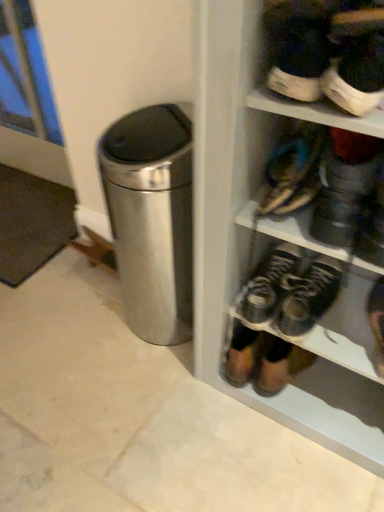
This screenshot has height=512, width=384. Describe the element at coordinates (294, 170) in the screenshot. I see `leather sandals at upper right, which ranks as the third footwear in bottom-to-top order` at that location.

The width and height of the screenshot is (384, 512). Identify the location of dark brown leather shoes at center, the 2th footwear from the bottom. (268, 285).

In the scene shown: Does white rubber sneaker at upper right, which ranks as the 4th footwear in bottom-to-top order, come in front of dark brown leather shoes at center, the 2th footwear from the bottom?

That is True.

Consider the image. From the image's perspective, who appears lower, white rubber sneaker at upper right, which ranks as the 4th footwear in bottom-to-top order, or dark brown leather shoes at center, which is the third footwear from top to bottom?

dark brown leather shoes at center, which is the third footwear from top to bottom.

What's the angular difference between white rubber sneaker at upper right, which ranks as the 4th footwear in bottom-to-top order, and dark brown leather shoes at center, which is the third footwear from top to bottom,'s facing directions?

The angular difference between white rubber sneaker at upper right, which ranks as the 4th footwear in bottom-to-top order, and dark brown leather shoes at center, which is the third footwear from top to bottom, is 1.18 degrees.

Which of these two, white rubber sneaker at upper right, which ranks as the 4th footwear in bottom-to-top order, or dark brown leather shoes at center, the 2th footwear from the bottom, is bigger?

Bigger between the two is dark brown leather shoes at center, the 2th footwear from the bottom.

There is a dark brown leather shoes at center, the 2th footwear from the bottom. At what (x,y) coordinates should I click in order to perform the action: click on the 2nd footwear above it (from a real-world perspective). Please return your answer as a coordinate pair (x, y). This screenshot has height=512, width=384. Looking at the image, I should click on pyautogui.click(x=294, y=170).

How different are the orientations of dark brown leather shoes at center, the 2th footwear from the bottom, and leather sandals at upper right, which ranks as the third footwear in bottom-to-top order, in degrees?

The angle between the facing direction of dark brown leather shoes at center, the 2th footwear from the bottom, and the facing direction of leather sandals at upper right, which ranks as the third footwear in bottom-to-top order, is 3.46 degrees.

Which is in front, point (271, 302) or point (294, 166)?

The point (294, 166) is closer to the camera.

From the picture: Considering the sizes of objects dark brown leather shoes at center, which is the third footwear from top to bottom, and leather sandals at upper right, which ranks as the third footwear in bottom-to-top order, in the image provided, who is wider, dark brown leather shoes at center, which is the third footwear from top to bottom, or leather sandals at upper right, which ranks as the third footwear in bottom-to-top order,?

Wider between the two is leather sandals at upper right, which ranks as the third footwear in bottom-to-top order.

From the picture: Is leather shoe at lower right, the first footwear ordered from the bottom, positioned with its back to dark brown leather shoes at center, which is the third footwear from top to bottom?

leather shoe at lower right, the first footwear ordered from the bottom, is not turned away from dark brown leather shoes at center, which is the third footwear from top to bottom.

Who is shorter, leather shoe at lower right, the first footwear ordered from the bottom, or dark brown leather shoes at center, which is the third footwear from top to bottom?

With less height is leather shoe at lower right, the first footwear ordered from the bottom.

Between leather shoe at lower right, the first footwear ordered from the bottom, and dark brown leather shoes at center, the 2th footwear from the bottom, which one has smaller width?

With smaller width is dark brown leather shoes at center, the 2th footwear from the bottom.

Identify the location of the 2nd footwear to the right of the white rubber sneaker at upper right, arranged as the 1th footwear when viewed from the top, counting from the anchor's position. The height and width of the screenshot is (512, 384). 377,322.

Is point (309, 48) in front of point (374, 292)?

Yes.

Based on the photo, are white rubber sneaker at upper right, arranged as the 1th footwear when viewed from the top, and leather shoe at lower right, the first footwear ordered from the bottom, far apart?

Actually, white rubber sneaker at upper right, arranged as the 1th footwear when viewed from the top, and leather shoe at lower right, the first footwear ordered from the bottom, are a little close together.

Based on the photo, is white rubber sneaker at upper right, arranged as the 1th footwear when viewed from the top, bigger or smaller than leather shoe at lower right, the first footwear ordered from the bottom?

Clearly, white rubber sneaker at upper right, arranged as the 1th footwear when viewed from the top, is smaller in size than leather shoe at lower right, the first footwear ordered from the bottom.

From a real-world perspective, is leather shoe at lower right, the first footwear ordered from the bottom, physically above leather sandals at upper right, which ranks as the third footwear in bottom-to-top order?

No, from a real-world perspective, leather shoe at lower right, the first footwear ordered from the bottom, is not on top of leather sandals at upper right, which ranks as the third footwear in bottom-to-top order.

From the image's perspective, is leather shoe at lower right, the first footwear ordered from the bottom, positioned above or below leather sandals at upper right, which appears as the second footwear when viewed from the top?

From the image's perspective, leather shoe at lower right, the first footwear ordered from the bottom, appears below leather sandals at upper right, which appears as the second footwear when viewed from the top.

Is leather shoe at lower right, the first footwear ordered from the bottom, at the left side of leather sandals at upper right, which appears as the second footwear when viewed from the top?

Incorrect, leather shoe at lower right, the first footwear ordered from the bottom, is not on the left side of leather sandals at upper right, which appears as the second footwear when viewed from the top.

Considering the positions of objects leather shoe at lower right, the fourth footwear positioned from the top, and leather sandals at upper right, which ranks as the third footwear in bottom-to-top order, in the image provided, who is in front, leather shoe at lower right, the fourth footwear positioned from the top, or leather sandals at upper right, which ranks as the third footwear in bottom-to-top order,?

leather sandals at upper right, which ranks as the third footwear in bottom-to-top order, is in front.

Is leather shoe at lower right, the first footwear ordered from the bottom, with white rubber sneaker at upper right, arranged as the 1th footwear when viewed from the top?

No.

Could you measure the distance between leather shoe at lower right, the fourth footwear positioned from the top, and white rubber sneaker at upper right, which ranks as the 4th footwear in bottom-to-top order?

leather shoe at lower right, the fourth footwear positioned from the top, and white rubber sneaker at upper right, which ranks as the 4th footwear in bottom-to-top order, are 59.26 centimeters apart from each other.

Is white rubber sneaker at upper right, arranged as the 1th footwear when viewed from the top, at the back of leather shoe at lower right, the fourth footwear positioned from the top?

No.

Is leather shoe at lower right, the first footwear ordered from the bottom, inside or outside of white rubber sneaker at upper right, which ranks as the 4th footwear in bottom-to-top order?

leather shoe at lower right, the first footwear ordered from the bottom, is not enclosed by white rubber sneaker at upper right, which ranks as the 4th footwear in bottom-to-top order.

Is white rubber sneaker at upper right, which ranks as the 4th footwear in bottom-to-top order, facing away from leather sandals at upper right, which ranks as the third footwear in bottom-to-top order?

No, leather sandals at upper right, which ranks as the third footwear in bottom-to-top order, is not at the back of white rubber sneaker at upper right, which ranks as the 4th footwear in bottom-to-top order.

Between white rubber sneaker at upper right, which ranks as the 4th footwear in bottom-to-top order, and leather sandals at upper right, which appears as the second footwear when viewed from the top, which one has smaller size?

white rubber sneaker at upper right, which ranks as the 4th footwear in bottom-to-top order, is smaller.

From a real-world perspective, is white rubber sneaker at upper right, which ranks as the 4th footwear in bottom-to-top order, physically above leather sandals at upper right, which ranks as the third footwear in bottom-to-top order?

Indeed, from a real-world perspective, white rubber sneaker at upper right, which ranks as the 4th footwear in bottom-to-top order, stands above leather sandals at upper right, which ranks as the third footwear in bottom-to-top order.

How many degrees apart are the facing directions of white rubber sneaker at upper right, arranged as the 1th footwear when viewed from the top, and leather sandals at upper right, which ranks as the third footwear in bottom-to-top order?

white rubber sneaker at upper right, arranged as the 1th footwear when viewed from the top, and leather sandals at upper right, which ranks as the third footwear in bottom-to-top order, are facing 4.65 degrees away from each other.

From the image's perspective, count 2nd footwears upward from the dark brown leather shoes at center, the 2th footwear from the bottom, and point to it. Please provide its 2D coordinates.

[(323, 55)]

Where is `the 2nd footwear to the left when counting from the leather sandals at upper right, which appears as the second footwear when viewed from the top`? The width and height of the screenshot is (384, 512). the 2nd footwear to the left when counting from the leather sandals at upper right, which appears as the second footwear when viewed from the top is located at coordinates (268, 285).

Considering their positions, is leather shoe at lower right, the first footwear ordered from the bottom, positioned further to white rubber sneaker at upper right, arranged as the 1th footwear when viewed from the top, than dark brown leather shoes at center, which is the third footwear from top to bottom?

Among the two, leather shoe at lower right, the first footwear ordered from the bottom, is located further to white rubber sneaker at upper right, arranged as the 1th footwear when viewed from the top.

Estimate the real-world distances between objects in this image. Which object is closer to leather sandals at upper right, which ranks as the third footwear in bottom-to-top order, dark brown leather shoes at center, the 2th footwear from the bottom, or white rubber sneaker at upper right, which ranks as the 4th footwear in bottom-to-top order?

The object closer to leather sandals at upper right, which ranks as the third footwear in bottom-to-top order, is white rubber sneaker at upper right, which ranks as the 4th footwear in bottom-to-top order.

When comparing their distances from dark brown leather shoes at center, which is the third footwear from top to bottom, does leather shoe at lower right, the first footwear ordered from the bottom, or white rubber sneaker at upper right, which ranks as the 4th footwear in bottom-to-top order, seem closer?

leather shoe at lower right, the first footwear ordered from the bottom, lies closer to dark brown leather shoes at center, which is the third footwear from top to bottom, than the other object.

Based on their spatial positions, is leather sandals at upper right, which ranks as the third footwear in bottom-to-top order, or leather shoe at lower right, the first footwear ordered from the bottom, further from white rubber sneaker at upper right, which ranks as the 4th footwear in bottom-to-top order?

leather shoe at lower right, the first footwear ordered from the bottom.

Looking at the image, which one is located closer to leather shoe at lower right, the fourth footwear positioned from the top, leather sandals at upper right, which ranks as the third footwear in bottom-to-top order, or white rubber sneaker at upper right, which ranks as the 4th footwear in bottom-to-top order?

Among the two, leather sandals at upper right, which ranks as the third footwear in bottom-to-top order, is located nearer to leather shoe at lower right, the fourth footwear positioned from the top.

From the image, which object appears to be farther from leather shoe at lower right, the fourth footwear positioned from the top, dark brown leather shoes at center, the 2th footwear from the bottom, or leather sandals at upper right, which ranks as the third footwear in bottom-to-top order?

leather sandals at upper right, which ranks as the third footwear in bottom-to-top order.

Looking at this image, when comparing their distances from dark brown leather shoes at center, which is the third footwear from top to bottom, does leather sandals at upper right, which appears as the second footwear when viewed from the top, or white rubber sneaker at upper right, which ranks as the 4th footwear in bottom-to-top order, seem further?

Based on the image, white rubber sneaker at upper right, which ranks as the 4th footwear in bottom-to-top order, appears to be further to dark brown leather shoes at center, which is the third footwear from top to bottom.

When comparing their distances from leather sandals at upper right, which ranks as the third footwear in bottom-to-top order, does white rubber sneaker at upper right, arranged as the 1th footwear when viewed from the top, or leather shoe at lower right, the first footwear ordered from the bottom, seem further?

Based on the image, leather shoe at lower right, the first footwear ordered from the bottom, appears to be further to leather sandals at upper right, which ranks as the third footwear in bottom-to-top order.

Identify the location of footwear between leather sandals at upper right, which ranks as the third footwear in bottom-to-top order, and leather shoe at lower right, the fourth footwear positioned from the top, in the up-down direction. click(x=268, y=285).

The width and height of the screenshot is (384, 512). Find the location of `footwear between white rubber sneaker at upper right, which ranks as the 4th footwear in bottom-to-top order, and dark brown leather shoes at center, the 2th footwear from the bottom, from top to bottom`. footwear between white rubber sneaker at upper right, which ranks as the 4th footwear in bottom-to-top order, and dark brown leather shoes at center, the 2th footwear from the bottom, from top to bottom is located at coordinates (294, 170).